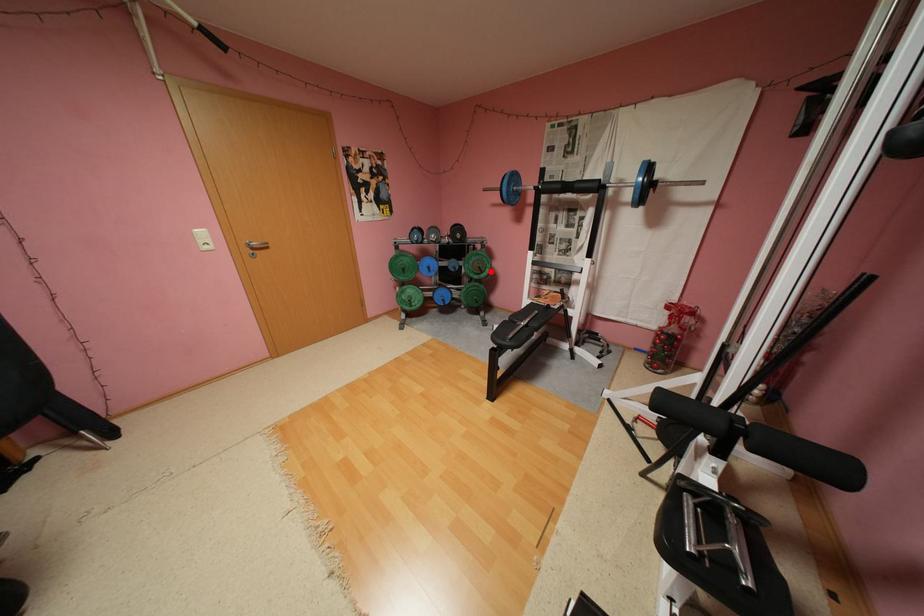
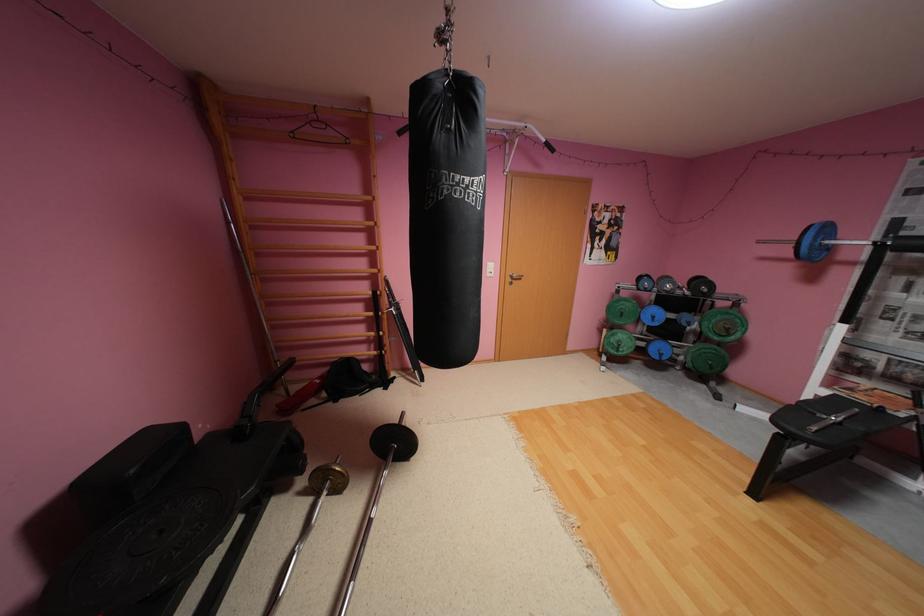
Question: I am providing you with two images of the same scene from different viewpoints. In image1, a red point is highlighted. Considering the same 3D point in image2, which of the following is correct?

Choices:
 (A) It is closer
 (B) It is farther

Answer: (B)